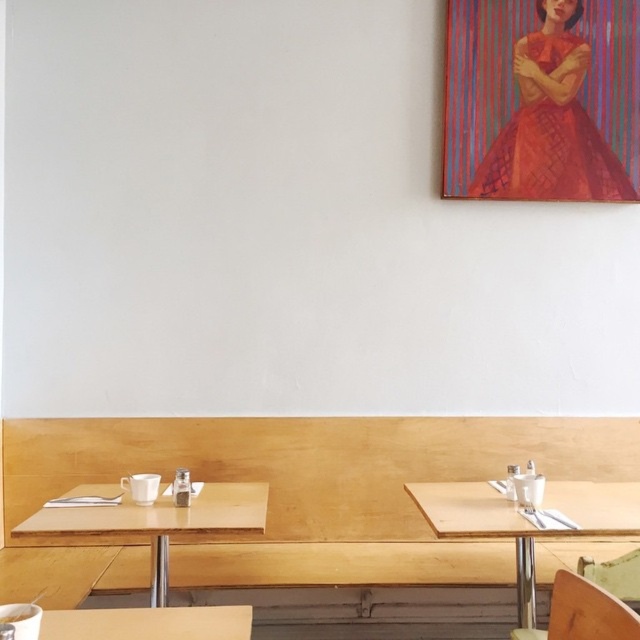
Question: Among these points, which one is nearest to the camera?

Choices:
 (A) (515, 512)
 (B) (612, 636)
 (C) (157, 624)

Answer: (B)

Question: Which of the following is the farthest from the observer?

Choices:
 (A) (248, 611)
 (B) (61, 513)
 (C) (518, 557)

Answer: (C)

Question: Which of these objects is positioned closest to the red woven fabric dress at upper right?

Choices:
 (A) light wood table at lower left
 (B) wooden chair at lower right
 (C) wooden table at lower center
 (D) wooden table at right

Answer: (D)

Question: Does wooden chair at lower right appear under wooden table at lower center?

Choices:
 (A) no
 (B) yes

Answer: (A)

Question: Does light wood table at lower left appear over wooden chair at lower right?

Choices:
 (A) yes
 (B) no

Answer: (B)

Question: Is red woven fabric dress at upper right above wooden table at lower center?

Choices:
 (A) no
 (B) yes

Answer: (B)